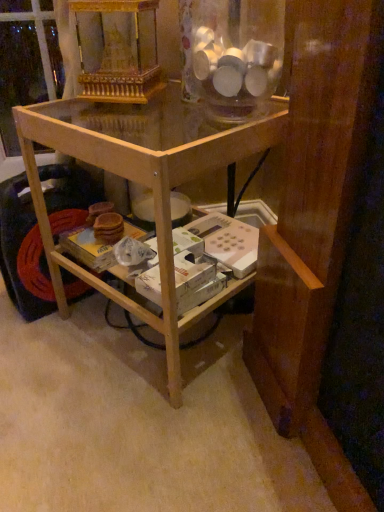
Question: Is transparent glass jar at upper center to the left of light brown wood table at center from the viewer's perspective?

Choices:
 (A) no
 (B) yes

Answer: (A)

Question: Is transparent glass jar at upper center facing towards light brown wood table at center?

Choices:
 (A) no
 (B) yes

Answer: (A)

Question: Is transparent glass jar at upper center turned away from light brown wood table at center?

Choices:
 (A) no
 (B) yes

Answer: (A)

Question: From a real-world perspective, is transparent glass jar at upper center below light brown wood table at center?

Choices:
 (A) yes
 (B) no

Answer: (B)

Question: Is transparent glass jar at upper center next to light brown wood table at center?

Choices:
 (A) no
 (B) yes

Answer: (A)

Question: Considering the relative sizes of transparent glass jar at upper center and light brown wood table at center in the image provided, is transparent glass jar at upper center taller than light brown wood table at center?

Choices:
 (A) yes
 (B) no

Answer: (B)

Question: Is light brown wood table at center in contact with transparent glass jar at upper center?

Choices:
 (A) yes
 (B) no

Answer: (B)

Question: Can you confirm if light brown wood table at center is positioned to the right of transparent glass jar at upper center?

Choices:
 (A) yes
 (B) no

Answer: (B)

Question: Is light brown wood table at center in front of transparent glass jar at upper center?

Choices:
 (A) yes
 (B) no

Answer: (A)

Question: From a real-world perspective, does light brown wood table at center stand above transparent glass jar at upper center?

Choices:
 (A) yes
 (B) no

Answer: (B)

Question: Is light brown wood table at center outside of transparent glass jar at upper center?

Choices:
 (A) yes
 (B) no

Answer: (A)

Question: Is light brown wood table at center thinner than transparent glass jar at upper center?

Choices:
 (A) yes
 (B) no

Answer: (B)

Question: Considering the positions of transparent glass jar at upper center and light brown wood table at center in the image, is transparent glass jar at upper center wider or thinner than light brown wood table at center?

Choices:
 (A) thin
 (B) wide

Answer: (A)